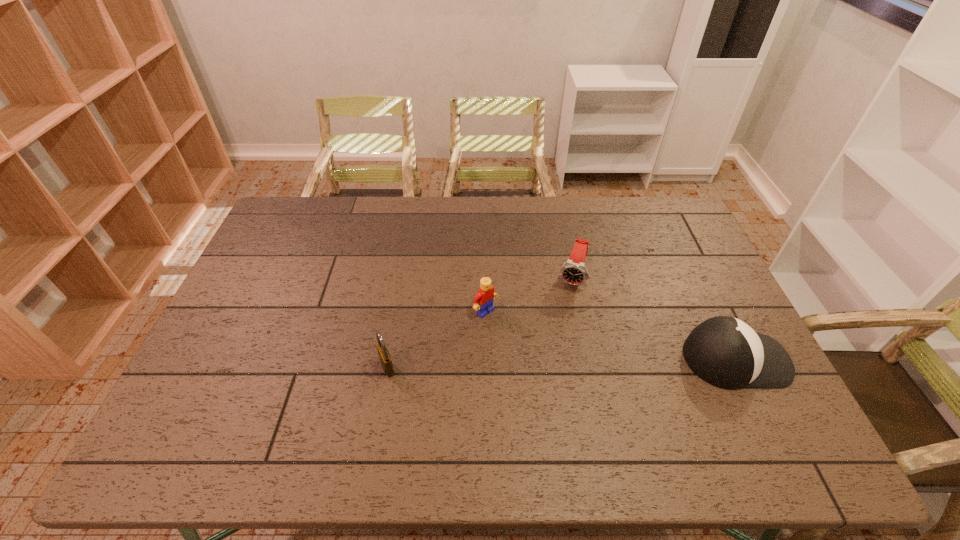
Find the location of a particular element. The image size is (960, 540). free spot located on the face of the watch is located at coordinates (549, 360).

The height and width of the screenshot is (540, 960). What are the coordinates of `vacant space located 0.220m on the face of the watch` in the screenshot? It's located at (552, 348).

Identify the location of vacant point located 0.330m on the face of the watch. This screenshot has width=960, height=540. (542, 381).

The height and width of the screenshot is (540, 960). In order to click on object located in the near edge section of the desktop in this screenshot , I will do `click(725, 352)`.

Where is `object that is at the right edge`? This screenshot has width=960, height=540. object that is at the right edge is located at coordinates (725, 352).

Find the location of a particular element. This screenshot has width=960, height=540. object at the near right corner is located at coordinates (725, 352).

The image size is (960, 540). In the image, there is a desktop. What are the coordinates of `vacant space at the far edge` in the screenshot? It's located at (566, 202).

This screenshot has height=540, width=960. I want to click on vacant region at the near edge, so click(x=513, y=404).

The height and width of the screenshot is (540, 960). I want to click on free space at the left edge of the desktop, so [x=307, y=238].

I want to click on free space at the far left corner, so click(317, 204).